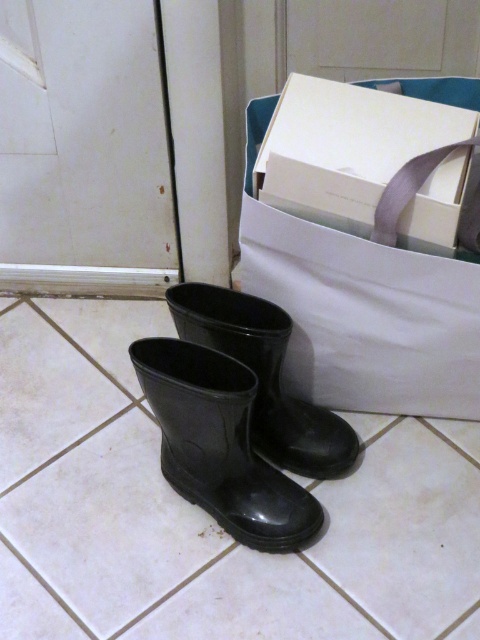
Question: Which of these objects is positioned closest to the white cardboard box at upper right?

Choices:
 (A) glossy rubber boot at center
 (B) black rubber boot at lower center

Answer: (A)

Question: Which of the following is the closest to the observer?

Choices:
 (A) (274, 518)
 (B) (215, 317)

Answer: (A)

Question: Does black rubber boot at lower center have a greater width compared to glossy rubber boot at center?

Choices:
 (A) no
 (B) yes

Answer: (A)

Question: Does white cardboard box at upper right appear on the right side of glossy rubber boot at center?

Choices:
 (A) yes
 (B) no

Answer: (A)

Question: Does white cardboard box at upper right have a larger size compared to black rubber boot at lower center?

Choices:
 (A) no
 (B) yes

Answer: (A)

Question: Among these points, which one is nearest to the camera?

Choices:
 (A) (200, 490)
 (B) (302, 200)
 (C) (326, 452)

Answer: (B)